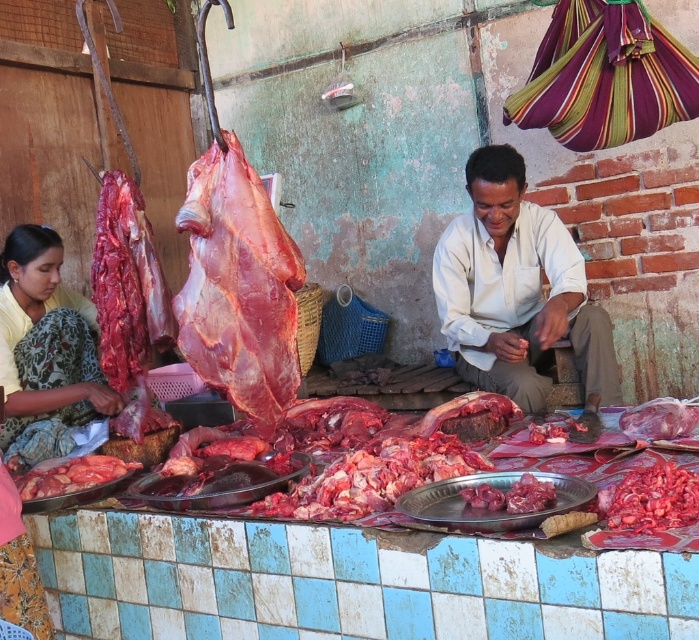
Is white matte shirt at center taller than yellow fabric saree at left?

Yes, white matte shirt at center is taller than yellow fabric saree at left.

Which is more to the right, white matte shirt at center or yellow fabric saree at left?

Positioned to the right is white matte shirt at center.

Measure the distance between white matte shirt at center and camera.

3.14 meters

This screenshot has height=640, width=699. I want to click on white matte shirt at center, so click(x=517, y=291).